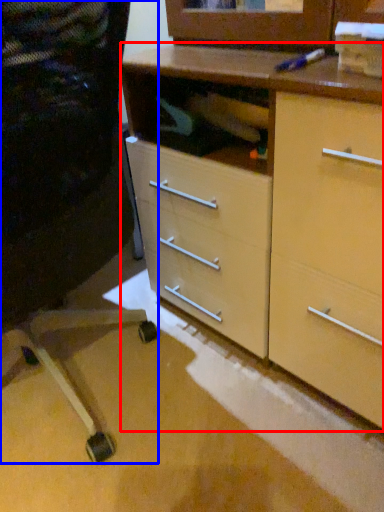
Question: Which object appears closest to the camera in this image, chest of drawers (highlighted by a red box) or computer chair (highlighted by a blue box)?

Choices:
 (A) chest of drawers
 (B) computer chair

Answer: (B)